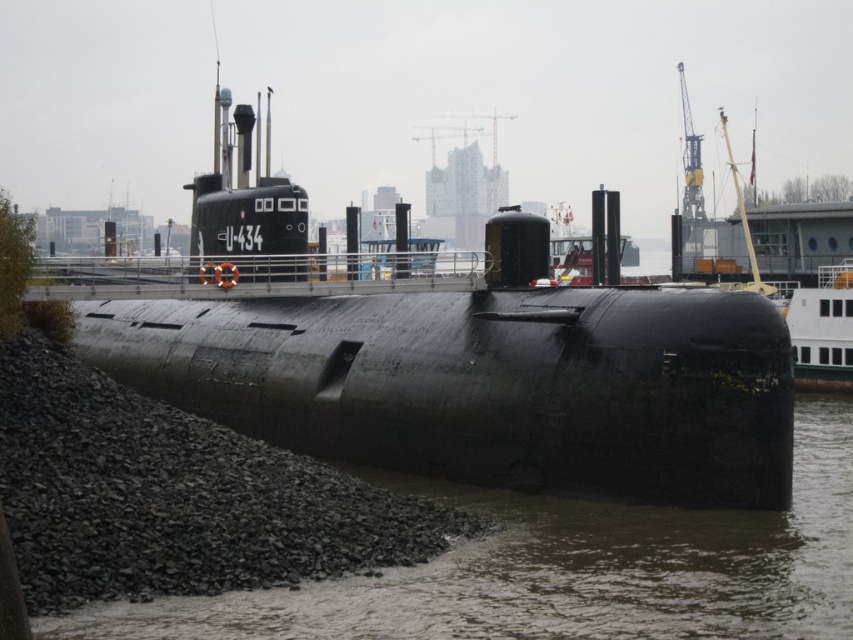
Can you confirm if matte black submarine at center is shorter than brown murky water at lower center?

No.

Between matte black submarine at center and brown murky water at lower center, which one has more height?

Standing taller between the two is matte black submarine at center.

Who is more forward, [410,429] or [209,602]?

Point [209,602] is more forward.

You are a GUI agent. You are given a task and a screenshot of the screen. Output one action in this format:
    pyautogui.click(x=<x>, y=<y>)
    Task: Click on the matte black submarine at center
    
    Given the screenshot: What is the action you would take?
    pyautogui.click(x=492, y=385)

Which is behind, point (117, 99) or point (97, 436)?

Point (117, 99)

Find the location of a particular element. matte black submarine at center is located at coordinates (492, 385).

Where is `matte black submarine at center`? matte black submarine at center is located at coordinates (492, 385).

At what (x,y) coordinates should I click in order to perform the action: click on matte black submarine at center. Please return your answer as a coordinate pair (x, y). Looking at the image, I should click on (492, 385).

Does brown murky water at lower center appear under black gravel at lower left?

Yes.

Is brown murky water at lower center bigger than black gravel at lower left?

No.

At what (x,y) coordinates should I click in order to perform the action: click on brown murky water at lower center. Please return your answer as a coordinate pair (x, y). Image resolution: width=853 pixels, height=640 pixels. Looking at the image, I should click on (567, 570).